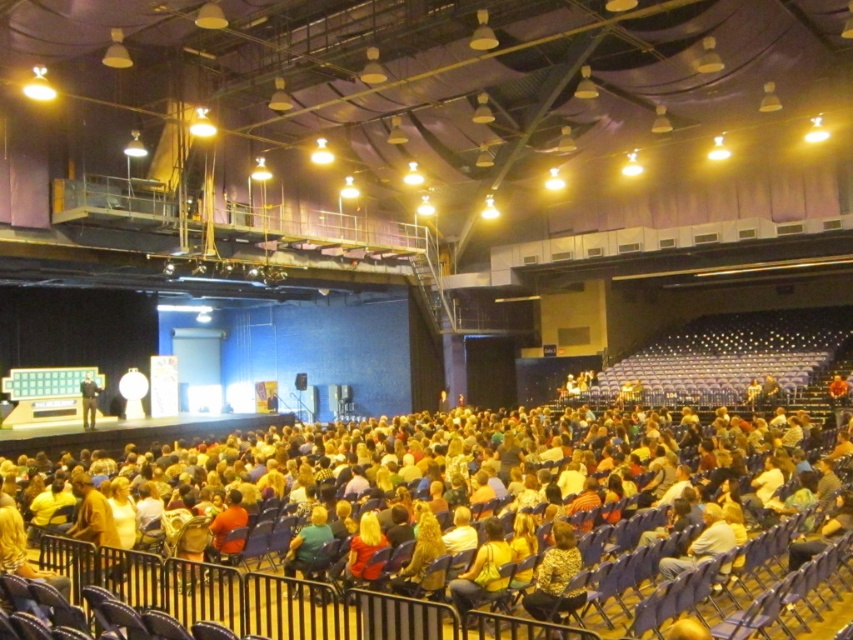
You are sitting in the auditorium and want to know if the point at coordinate (720, 634) is closer to the stage than the point at coordinate (718, 515). Can you determine this based on their positions?

Yes, the point at coordinate (720, 634) is in front of the point at coordinate (718, 515), so it is closer to the stage.